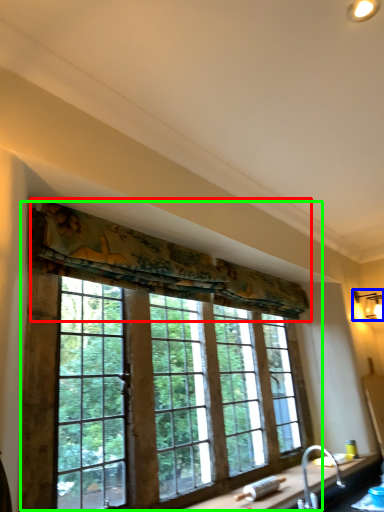
Question: Considering the real-world distances, which object is farthest from curtain (highlighted by a red box)? light fixture (highlighted by a blue box) or window (highlighted by a green box)?

Choices:
 (A) light fixture
 (B) window

Answer: (A)